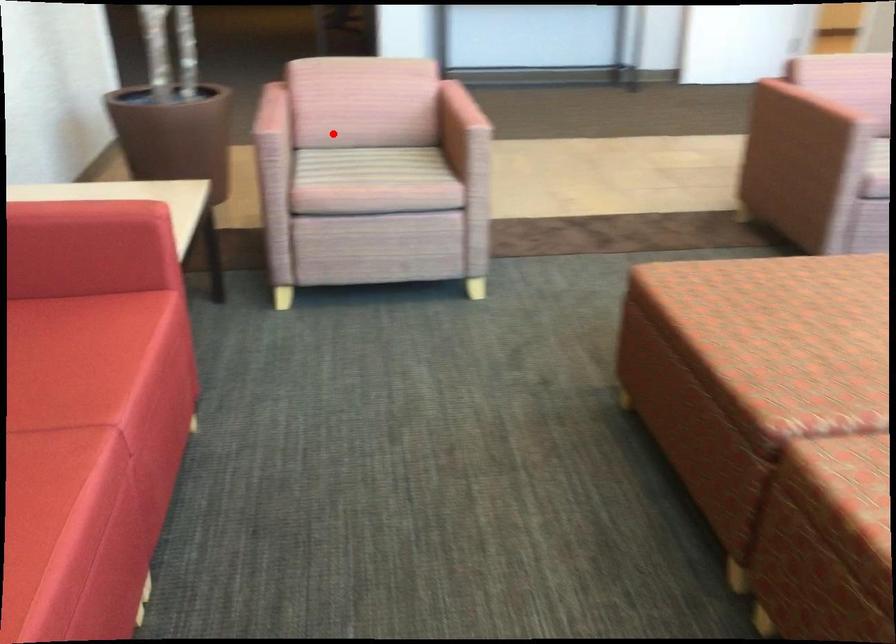
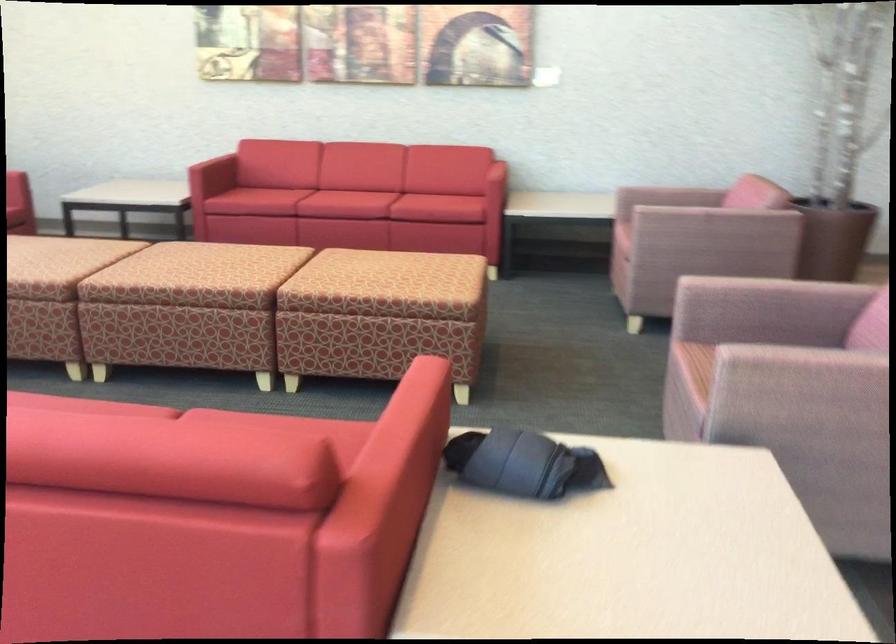
Question: I am providing you with two images of the same scene from different viewpoints. Image1 has a red point marked. In image2, the corresponding 3D location appears at what relative position? Reply with the corresponding letter.

Choices:
 (A) Closer
 (B) Farther

Answer: (B)